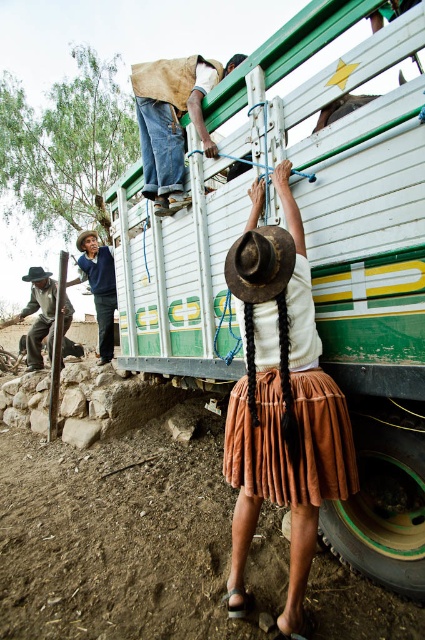
You are a photographer trying to capture a clear shot of the brown canvas bag at upper center and the brown leather cowboy hat at center. Which object should you focus on first if you want to ensure both are in focus without adjusting your camera settings?

The brown leather cowboy hat at center is lower than the brown canvas bag at upper center, so focusing on the brown leather cowboy hat at center first would allow both objects to be in focus since it is closer to the camera.

You are a delivery person who needs to place a small package on either the blue sweater at lower left or the brown leather hat at left. Which object should you choose to ensure the package won

The blue sweater at lower left is taller than the brown leather hat at left, so placing the package on the blue sweater at lower left would be more stable and less likely to fall off.

You are a delivery person who needs to place a new item between the brown canvas bag at upper center and the brown leather cowboy hat at center. The item is 1.5 meters long. Can you fit it between them without moving either object?

The distance between the brown canvas bag at upper center and the brown leather cowboy hat at center is 1.82 meters. Since the item is 1.5 meters long, it can fit between them as there is enough space.